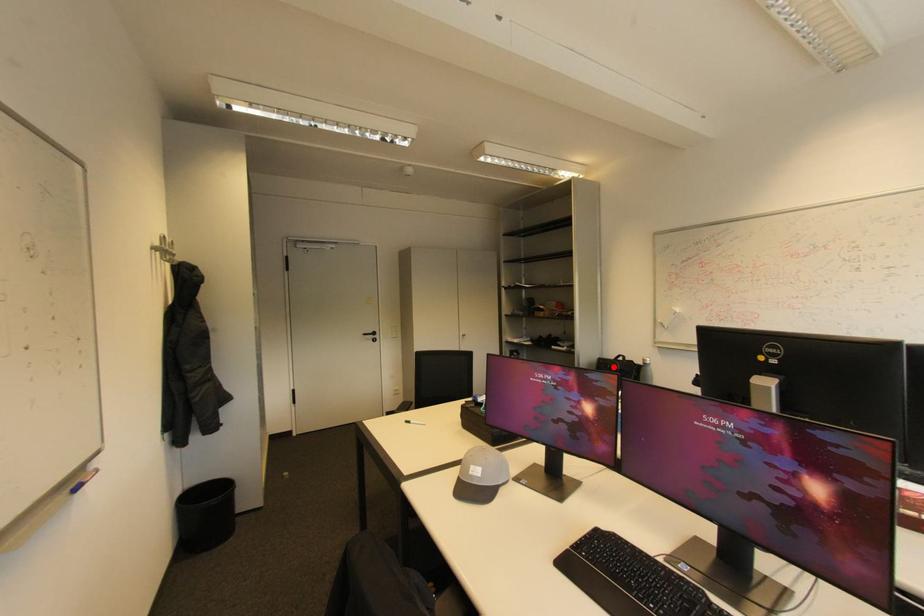
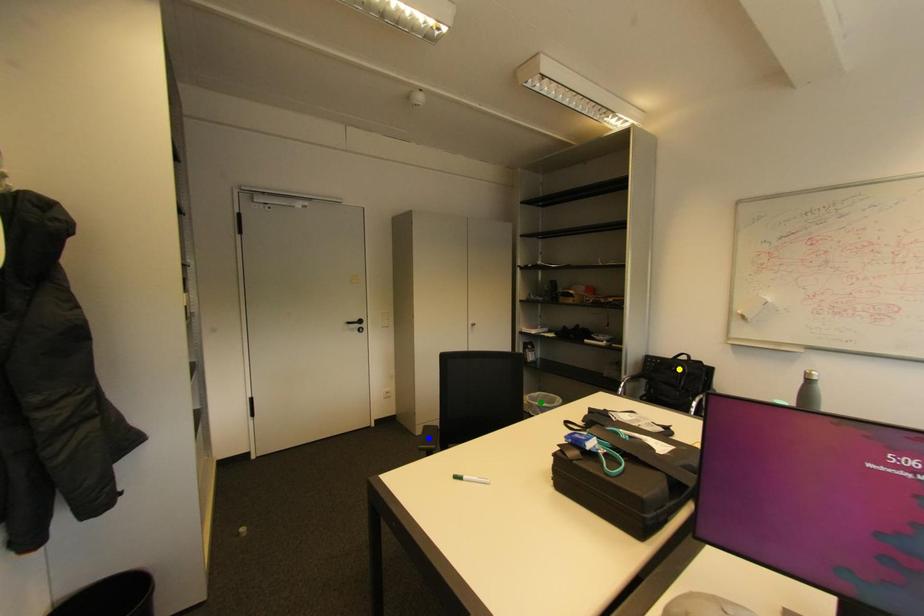
Question: I am providing you with two images of the same scene from different viewpoints. A red point is marked on the first image. You are given multiple points on the second image. Can you choose the point in image 2 that corresponds to the point in image 1?

Choices:
 (A) yellow point
 (B) green point
 (C) blue point

Answer: (A)